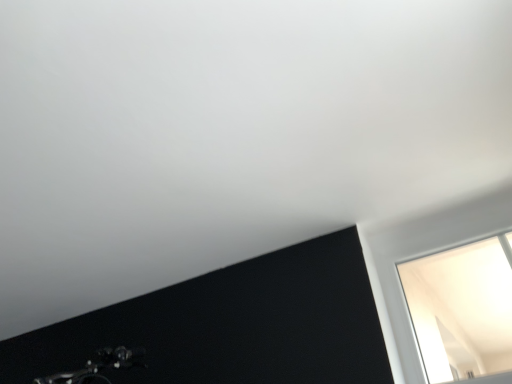
The image size is (512, 384). What do you see at coordinates (462, 309) in the screenshot?
I see `transparent glass window at upper right` at bounding box center [462, 309].

Identify the location of transparent glass window at upper right. This screenshot has width=512, height=384. (462, 309).

This screenshot has width=512, height=384. What are the coordinates of `transparent glass window at upper right` in the screenshot? It's located at (462, 309).